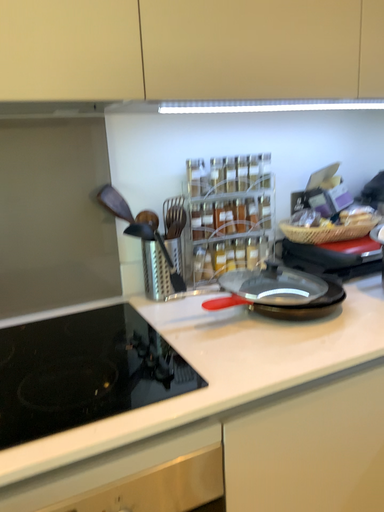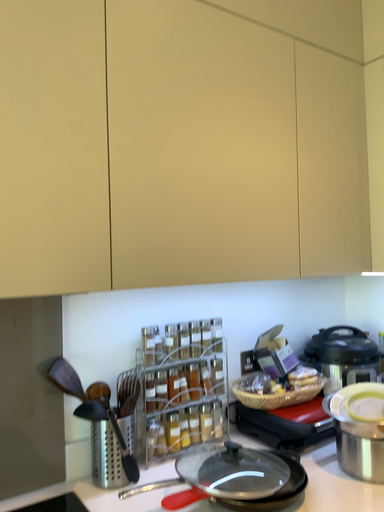
Question: How did the camera likely rotate when shooting the video?

Choices:
 (A) rotated downward
 (B) rotated upward

Answer: (B)